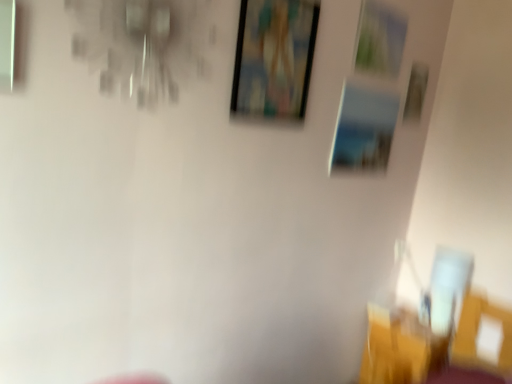
Question: Considering the relative positions of wooden picture frame at upper right, which is counted as the fourth picture frame, starting from the left, and metallic silver picture frame at upper right, the second picture frame viewed from the right, in the image provided, is wooden picture frame at upper right, which is counted as the fourth picture frame, starting from the left, to the left or to the right of metallic silver picture frame at upper right, the second picture frame viewed from the right,?

Choices:
 (A) left
 (B) right

Answer: (B)

Question: From the image's perspective, is wooden picture frame at upper right, which is counted as the fourth picture frame, starting from the left, above or below metallic silver picture frame at upper right, the second picture frame viewed from the right?

Choices:
 (A) above
 (B) below

Answer: (B)

Question: Which of these objects is positioned closest to the metallic silver picture frame at upper right, the second picture frame viewed from the right?

Choices:
 (A) yellow fabric chair at lower right
 (B) wooden picture frame at upper center, the 4th picture frame from the right
 (C) metallic silver picture frame at upper center, which is the second picture frame from left to right
 (D) wooden picture frame at upper right, the 1th picture frame positioned from the right

Answer: (C)

Question: Which of these objects is positioned farthest from the yellow fabric chair at lower right?

Choices:
 (A) wooden picture frame at upper right, the 1th picture frame positioned from the right
 (B) wooden picture frame at upper center, which is the first picture frame in left-to-right order
 (C) metallic silver picture frame at upper right, the second picture frame viewed from the right
 (D) metallic silver picture frame at upper center, which is the second picture frame from left to right

Answer: (B)